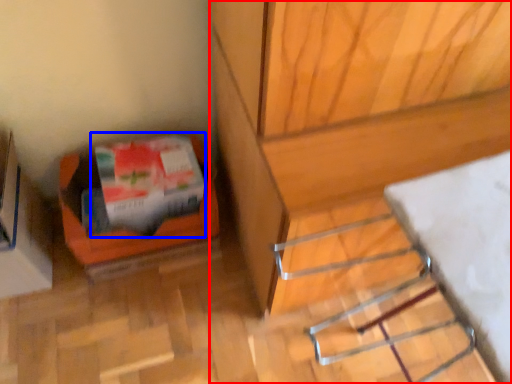
Question: Among these objects, which one is nearest to the camera, furniture (highlighted by a red box) or wrapping paper (highlighted by a blue box)?

Choices:
 (A) furniture
 (B) wrapping paper

Answer: (A)